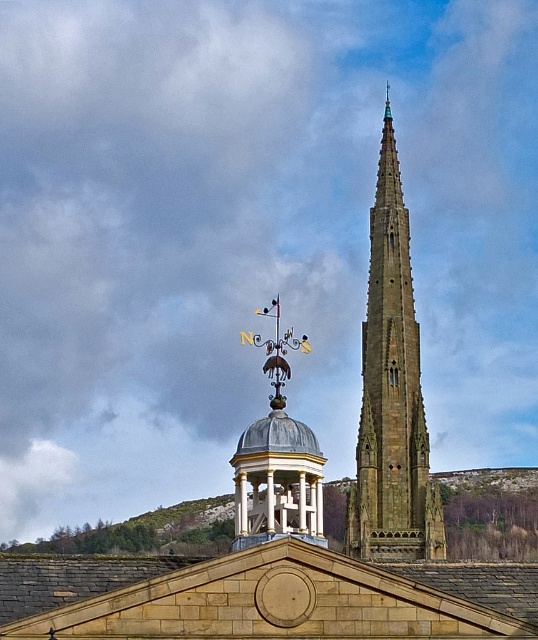
You are standing in front of the architectural structures and want to place a decorative flag on the highest point. Which object should you choose between the brown stone roof at center and the brown stone spire at center?

The brown stone spire at center is higher than the brown stone roof at center, so you should place the decorative flag on the brown stone spire at center.